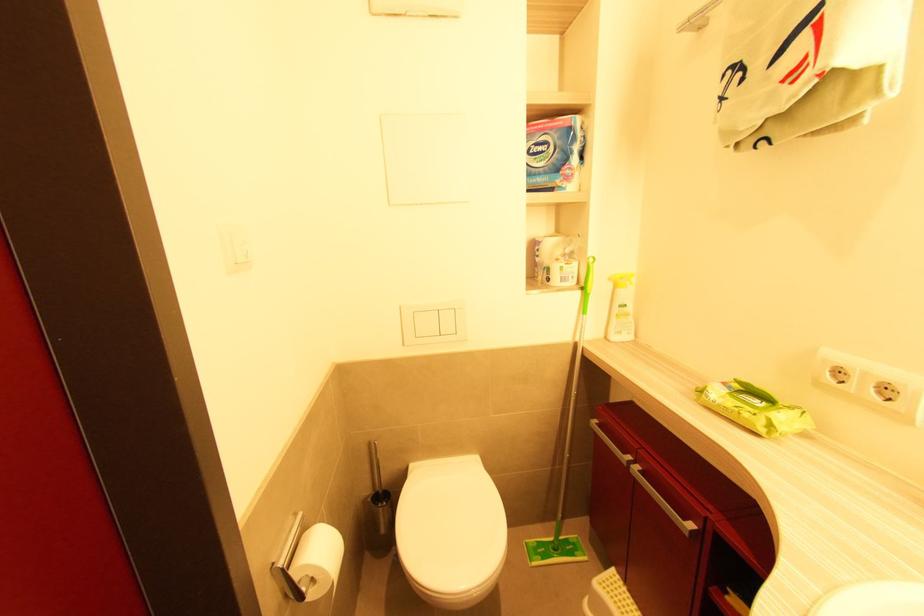
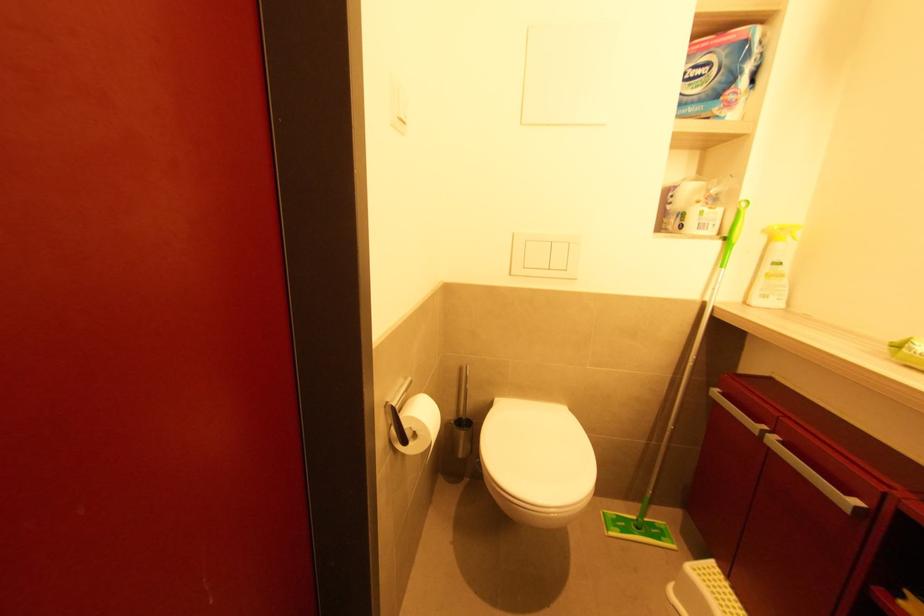
Question: In a continuous first-person perspective shot, in which direction is the camera moving?

Choices:
 (A) Left
 (B) Right
 (C) Forward
 (D) Backward

Answer: (A)